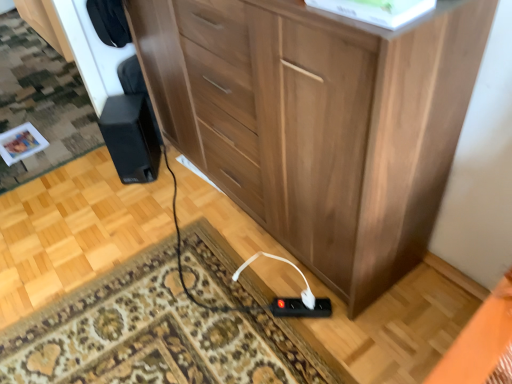
Locate an element on the screen. This screenshot has width=512, height=384. free location to the right of black plastic power strip at lower center, positioned as the first plug in left-to-right order is located at coordinates (360, 321).